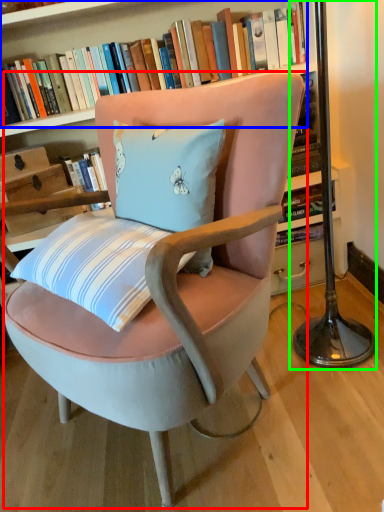
Question: Estimate the real-world distances between objects in this image. Which object is farther from chair (highlighted by a red box), book (highlighted by a blue box) or table lamp (highlighted by a green box)?

Choices:
 (A) book
 (B) table lamp

Answer: (A)